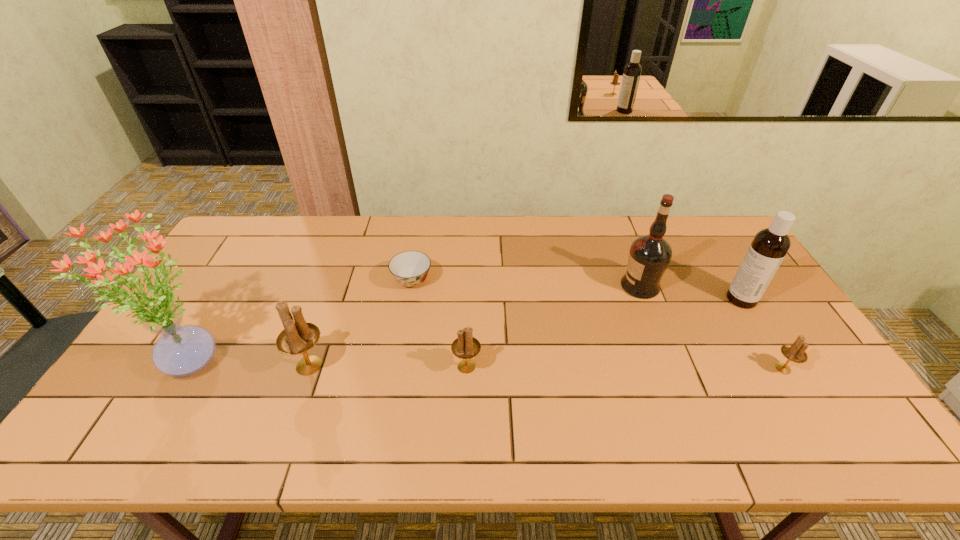
Identify the location of vacant space at the near edge of the desktop. This screenshot has height=540, width=960. (488, 409).

At what (x,y) coordinates should I click in order to perform the action: click on free space at the right edge. Please return your answer as a coordinate pair (x, y). The height and width of the screenshot is (540, 960). Looking at the image, I should click on (737, 319).

Where is `vacant space at the far left corner`? vacant space at the far left corner is located at coordinates (243, 227).

Image resolution: width=960 pixels, height=540 pixels. What are the coordinates of `vacant space at the near left corner of the desktop` in the screenshot? It's located at (134, 407).

Where is `free spot at the far right corner of the desktop`? This screenshot has width=960, height=540. free spot at the far right corner of the desktop is located at coordinates (728, 231).

I want to click on vacant region between the dishwasher detergent and the second tallest candle holder, so click(x=604, y=333).

The height and width of the screenshot is (540, 960). Identify the location of blank region between the fifth object from right to left and the dishwasher detergent. (577, 290).

At what (x,y) coordinates should I click in order to perform the action: click on vacant area that lies between the soup bowl and the shortest candle holder. Please return your answer as a coordinate pair (x, y). This screenshot has height=540, width=960. Looking at the image, I should click on (597, 325).

Where is `free space between the leftmost candle holder and the second candle holder from right to left`? This screenshot has width=960, height=540. free space between the leftmost candle holder and the second candle holder from right to left is located at coordinates (388, 366).

Locate an element on the screen. vacant area that lies between the dishwasher detergent and the fourth tallest object is located at coordinates (525, 332).